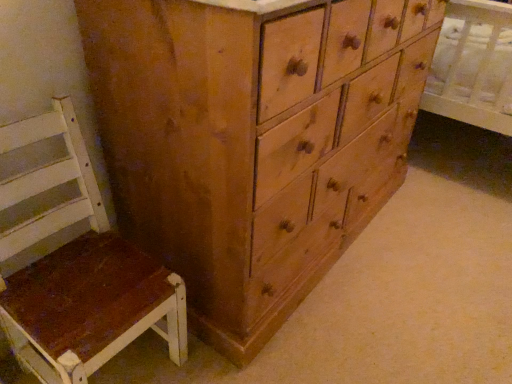
I want to click on free spot above wooden chest of drawers at center (from a real-world perspective), so click(409, 245).